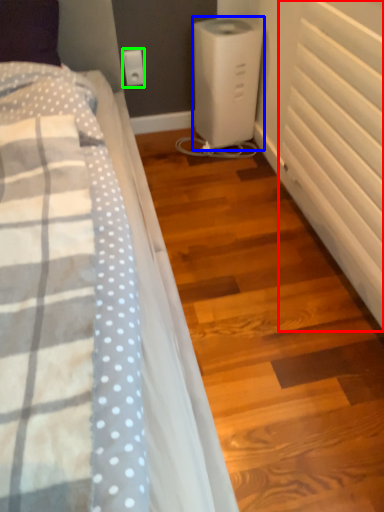
Question: Which object is positioned closest to radiator (highlighted by a red box)? Select from home appliance (highlighted by a blue box) and electric outlet (highlighted by a green box).

Choices:
 (A) home appliance
 (B) electric outlet

Answer: (A)